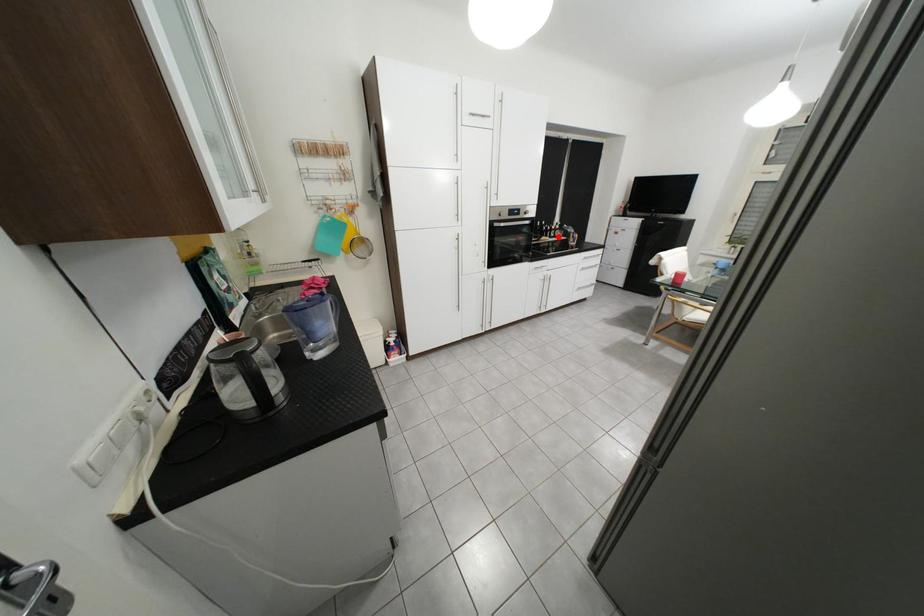
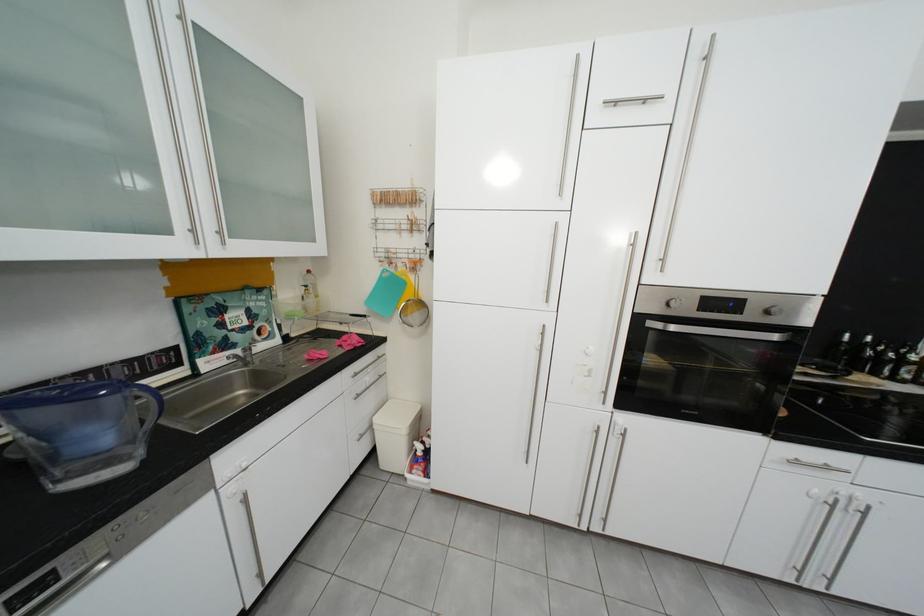
The point at the highlighted location is marked in the first image. Where is the corresponding point in the second image?

(886, 375)